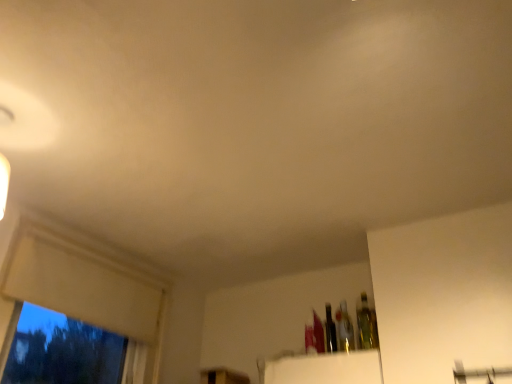
The image size is (512, 384). Describe the element at coordinates (86, 286) in the screenshot. I see `white matte window frame at left` at that location.

Measure the distance between point (x=376, y=332) and camera.

The distance of point (x=376, y=332) from camera is 6.51 feet.

This screenshot has height=384, width=512. What do you see at coordinates (330, 331) in the screenshot?
I see `shiny metallic bottle at upper right, the first bottle from the left` at bounding box center [330, 331].

The height and width of the screenshot is (384, 512). In order to click on white matte window frame at left in this screenshot , I will do `click(86, 286)`.

The width and height of the screenshot is (512, 384). Find the location of `bottle that is the 1st one when counting upward from the shiny metallic bottle at upper right, placed as the 3th bottle when sorted from right to left (from the image's perspective)`. bottle that is the 1st one when counting upward from the shiny metallic bottle at upper right, placed as the 3th bottle when sorted from right to left (from the image's perspective) is located at coordinates (344, 328).

Could you tell me if shiny metallic bottle at upper right, placed as the 3th bottle when sorted from right to left, is facing translucent glass bottle at center, which appears as the 2th bottle when viewed from the right?

No, shiny metallic bottle at upper right, placed as the 3th bottle when sorted from right to left, is not oriented towards translucent glass bottle at center, which appears as the 2th bottle when viewed from the right.

From a real-world perspective, is shiny metallic bottle at upper right, the first bottle from the left, physically located above or below translucent glass bottle at center, which appears as the 2th bottle when viewed from the right?

From a real-world perspective, shiny metallic bottle at upper right, the first bottle from the left, is physically below translucent glass bottle at center, which appears as the 2th bottle when viewed from the right.

Is shiny metallic bottle at upper right, the first bottle from the left, in front of translucent glass bottle at center, which is counted as the second bottle, starting from the left?

No, the depth of shiny metallic bottle at upper right, the first bottle from the left, is greater than that of translucent glass bottle at center, which is counted as the second bottle, starting from the left.

Which object is further away from the camera taking this photo, white matte window frame at left or translucent glass bottle at center, which is counted as the second bottle, starting from the left?

translucent glass bottle at center, which is counted as the second bottle, starting from the left, is more distant.

From the image's perspective, relative to translucent glass bottle at center, which appears as the 2th bottle when viewed from the right, is white matte window frame at left above or below?

From the image's perspective, white matte window frame at left appears above translucent glass bottle at center, which appears as the 2th bottle when viewed from the right.

Is translucent glass bottle at center, which is counted as the second bottle, starting from the left, at the back of white matte window frame at left?

white matte window frame at left does not have its back to translucent glass bottle at center, which is counted as the second bottle, starting from the left.

Who is smaller, white matte window frame at left or translucent glass bottle at center, which is counted as the second bottle, starting from the left?

With smaller size is translucent glass bottle at center, which is counted as the second bottle, starting from the left.

Is white matte window frame at left oriented away from translucent glass bottle at upper right, which ranks as the 1th bottle in right-to-left order?

No, white matte window frame at left's orientation is not away from translucent glass bottle at upper right, which ranks as the 1th bottle in right-to-left order.

Is white matte window frame at left beside translucent glass bottle at upper right, the 3th bottle in the left-to-right sequence?

No, white matte window frame at left is not in contact with translucent glass bottle at upper right, the 3th bottle in the left-to-right sequence.

Considering the relative sizes of white matte window frame at left and translucent glass bottle at upper right, which ranks as the 1th bottle in right-to-left order, in the image provided, is white matte window frame at left thinner than translucent glass bottle at upper right, which ranks as the 1th bottle in right-to-left order,?

No.

From the picture: From the image's perspective, is translucent glass bottle at center, which is counted as the second bottle, starting from the left, located beneath white matte window frame at left?

Yes, from the image's perspective, translucent glass bottle at center, which is counted as the second bottle, starting from the left, is beneath white matte window frame at left.

Considering their positions, is translucent glass bottle at center, which appears as the 2th bottle when viewed from the right, located in front of or behind white matte window frame at left?

translucent glass bottle at center, which appears as the 2th bottle when viewed from the right, is positioned farther from the viewer than white matte window frame at left.

Which is more to the right, translucent glass bottle at center, which appears as the 2th bottle when viewed from the right, or white matte window frame at left?

Positioned to the right is translucent glass bottle at center, which appears as the 2th bottle when viewed from the right.

You are a GUI agent. You are given a task and a screenshot of the screen. Output one action in this format:
    pyautogui.click(x=<x>, y=<y>)
    Task: Click on the bottle that is the 3rd object located behind the white matte window frame at left
    The height and width of the screenshot is (384, 512).
    Given the screenshot: What is the action you would take?
    pyautogui.click(x=330, y=331)

From the image's perspective, would you say white matte window frame at left is positioned over shiny metallic bottle at upper right, the first bottle from the left?

Indeed, from the image's perspective, white matte window frame at left is shown above shiny metallic bottle at upper right, the first bottle from the left.

Is white matte window frame at left shorter than shiny metallic bottle at upper right, placed as the 3th bottle when sorted from right to left?

In fact, white matte window frame at left may be taller than shiny metallic bottle at upper right, placed as the 3th bottle when sorted from right to left.

From a real-world perspective, is white matte window frame at left over shiny metallic bottle at upper right, placed as the 3th bottle when sorted from right to left?

Correct, in the physical world, white matte window frame at left is higher than shiny metallic bottle at upper right, placed as the 3th bottle when sorted from right to left.

Is point (340, 341) more distant than point (329, 315)?

No, (340, 341) is in front of (329, 315).

The image size is (512, 384). Find the location of `bottle that is the 1st object to the right of the shiny metallic bottle at upper right, the first bottle from the left, starting at the anchor`. bottle that is the 1st object to the right of the shiny metallic bottle at upper right, the first bottle from the left, starting at the anchor is located at coordinates (344, 328).

Can you confirm if translucent glass bottle at center, which appears as the 2th bottle when viewed from the right, is thinner than shiny metallic bottle at upper right, the first bottle from the left?

Yes, translucent glass bottle at center, which appears as the 2th bottle when viewed from the right, is thinner than shiny metallic bottle at upper right, the first bottle from the left.

Considering the relative positions of translucent glass bottle at center, which appears as the 2th bottle when viewed from the right, and translucent glass bottle at upper right, the 3th bottle in the left-to-right sequence, in the image provided, is translucent glass bottle at center, which appears as the 2th bottle when viewed from the right, to the right of translucent glass bottle at upper right, the 3th bottle in the left-to-right sequence, from the viewer's perspective?

In fact, translucent glass bottle at center, which appears as the 2th bottle when viewed from the right, is to the left of translucent glass bottle at upper right, the 3th bottle in the left-to-right sequence.

Based on the photo, does translucent glass bottle at center, which appears as the 2th bottle when viewed from the right, turn towards translucent glass bottle at upper right, which ranks as the 1th bottle in right-to-left order?

No, translucent glass bottle at center, which appears as the 2th bottle when viewed from the right, is not aimed at translucent glass bottle at upper right, which ranks as the 1th bottle in right-to-left order.

Considering the relative positions of translucent glass bottle at center, which appears as the 2th bottle when viewed from the right, and translucent glass bottle at upper right, the 3th bottle in the left-to-right sequence, in the image provided, is translucent glass bottle at center, which appears as the 2th bottle when viewed from the right, behind translucent glass bottle at upper right, the 3th bottle in the left-to-right sequence,?

Yes.

From the shiny metallic bottle at upper right, placed as the 3th bottle when sorted from right to left, count 1st bottles forward and point to it. Please provide its 2D coordinates.

[(344, 328)]

This screenshot has width=512, height=384. I want to click on the 1st bottle below the white matte window frame at left (from a real-world perspective), so click(x=344, y=328).

Looking at the image, which one is located closer to translucent glass bottle at upper right, which ranks as the 1th bottle in right-to-left order, white matte window frame at left or shiny metallic bottle at upper right, placed as the 3th bottle when sorted from right to left?

Among the two, shiny metallic bottle at upper right, placed as the 3th bottle when sorted from right to left, is located nearer to translucent glass bottle at upper right, which ranks as the 1th bottle in right-to-left order.

Looking at this image, based on their spatial positions, is shiny metallic bottle at upper right, placed as the 3th bottle when sorted from right to left, or white matte window frame at left closer to translucent glass bottle at upper right, the 3th bottle in the left-to-right sequence?

shiny metallic bottle at upper right, placed as the 3th bottle when sorted from right to left, is closer to translucent glass bottle at upper right, the 3th bottle in the left-to-right sequence.

Considering their positions, is translucent glass bottle at center, which is counted as the second bottle, starting from the left, positioned closer to translucent glass bottle at upper right, which ranks as the 1th bottle in right-to-left order, than shiny metallic bottle at upper right, placed as the 3th bottle when sorted from right to left?

translucent glass bottle at center, which is counted as the second bottle, starting from the left, is closer to translucent glass bottle at upper right, which ranks as the 1th bottle in right-to-left order.

When comparing their distances from white matte window frame at left, does translucent glass bottle at upper right, the 3th bottle in the left-to-right sequence, or translucent glass bottle at center, which appears as the 2th bottle when viewed from the right, seem closer?

translucent glass bottle at center, which appears as the 2th bottle when viewed from the right, is positioned closer to the anchor white matte window frame at left.

Which object lies nearer to the anchor point translucent glass bottle at upper right, the 3th bottle in the left-to-right sequence, translucent glass bottle at center, which is counted as the second bottle, starting from the left, or white matte window frame at left?

Among the two, translucent glass bottle at center, which is counted as the second bottle, starting from the left, is located nearer to translucent glass bottle at upper right, the 3th bottle in the left-to-right sequence.

From the image, which object appears to be nearer to translucent glass bottle at center, which is counted as the second bottle, starting from the left, white matte window frame at left or translucent glass bottle at upper right, the 3th bottle in the left-to-right sequence?

translucent glass bottle at upper right, the 3th bottle in the left-to-right sequence, is closer to translucent glass bottle at center, which is counted as the second bottle, starting from the left.

When comparing their distances from white matte window frame at left, does translucent glass bottle at center, which appears as the 2th bottle when viewed from the right, or shiny metallic bottle at upper right, placed as the 3th bottle when sorted from right to left, seem closer?

shiny metallic bottle at upper right, placed as the 3th bottle when sorted from right to left.

Looking at the image, which one is located further to white matte window frame at left, translucent glass bottle at upper right, the 3th bottle in the left-to-right sequence, or shiny metallic bottle at upper right, the first bottle from the left?

translucent glass bottle at upper right, the 3th bottle in the left-to-right sequence, is further to white matte window frame at left.

The width and height of the screenshot is (512, 384). What are the coordinates of `bottle between white matte window frame at left and translucent glass bottle at center, which is counted as the second bottle, starting from the left, from left to right` in the screenshot? It's located at (330, 331).

The width and height of the screenshot is (512, 384). What are the coordinates of `bottle between translucent glass bottle at upper right, the 3th bottle in the left-to-right sequence, and shiny metallic bottle at upper right, the first bottle from the left, in the front-back direction` in the screenshot? It's located at (344, 328).